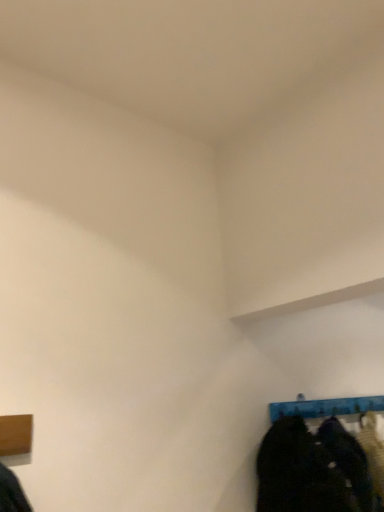
Find the location of a particular element. The height and width of the screenshot is (512, 384). dark fabric shoes at lower right is located at coordinates (312, 469).

In order to face dark fabric shoes at lower right, should I rotate leftwards or rightwards?

It's best to rotate right around 16.399 degrees.

Describe the element at coordinates (312, 469) in the screenshot. I see `dark fabric shoes at lower right` at that location.

Find the location of a particular element. The width and height of the screenshot is (384, 512). dark fabric shoes at lower right is located at coordinates (312, 469).